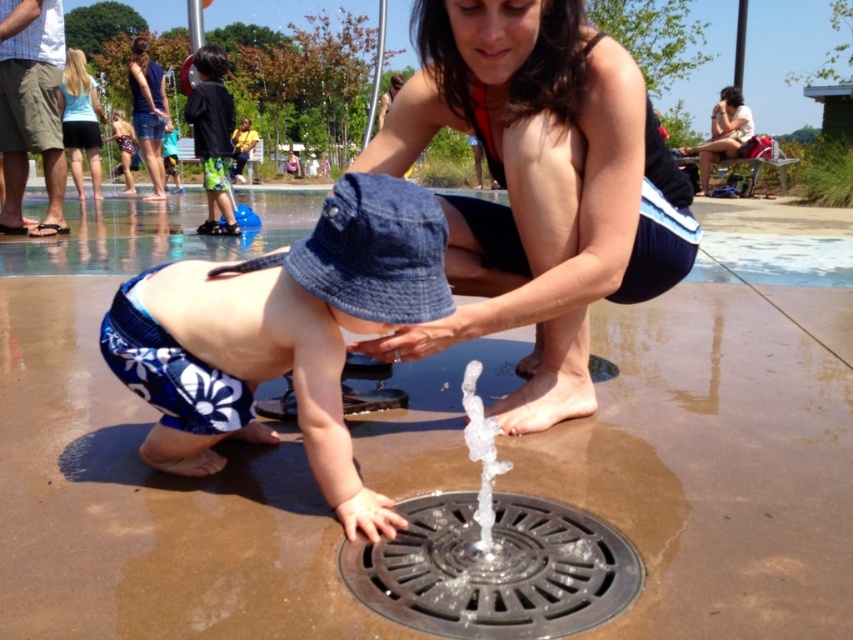
You are a photographer at the splash pad. You need to capture a photo of the green shorts at center and denim shorts at upper left. Which one is located lower in the image?

The green shorts at center is positioned under denim shorts at upper left, so the green shorts at center is lower in the image.

You are standing at the splash pad and want to take a photo of the child and the mother. The child is at point [161,422] and the mother is at point [225,225]. Which point is closer to your camera so that you can focus better?

Point [161,422] is closer to the camera than point [225,225], so focusing on that point will ensure the child is in focus while the mother may be slightly out of focus.